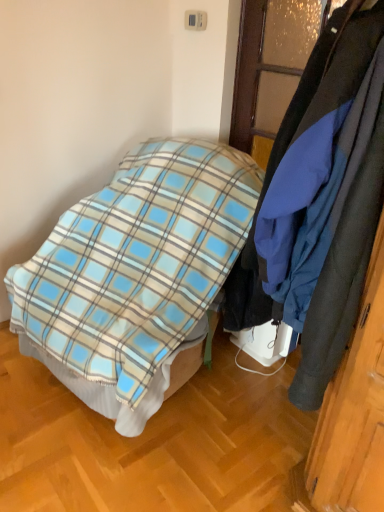
Question: Considering the relative sizes of blue plaid blanket at center and dark blue fabric coat at right in the image provided, is blue plaid blanket at center bigger than dark blue fabric coat at right?

Choices:
 (A) yes
 (B) no

Answer: (A)

Question: Is blue plaid blanket at center thinner than dark blue fabric coat at right?

Choices:
 (A) no
 (B) yes

Answer: (A)

Question: Is blue plaid blanket at center shorter than dark blue fabric coat at right?

Choices:
 (A) no
 (B) yes

Answer: (A)

Question: Is blue plaid blanket at center placed right next to dark blue fabric coat at right?

Choices:
 (A) no
 (B) yes

Answer: (A)

Question: From a real-world perspective, is blue plaid blanket at center located beneath dark blue fabric coat at right?

Choices:
 (A) no
 (B) yes

Answer: (B)

Question: Is blue plaid blanket at center facing away from dark blue fabric coat at right?

Choices:
 (A) no
 (B) yes

Answer: (A)

Question: Considering the relative sizes of dark blue fabric coat at right and blue plaid blanket at center in the image provided, is dark blue fabric coat at right taller than blue plaid blanket at center?

Choices:
 (A) yes
 (B) no

Answer: (B)

Question: Can you confirm if dark blue fabric coat at right is wider than blue plaid blanket at center?

Choices:
 (A) yes
 (B) no

Answer: (B)

Question: Is dark blue fabric coat at right with blue plaid blanket at center?

Choices:
 (A) yes
 (B) no

Answer: (B)

Question: Is dark blue fabric coat at right outside of blue plaid blanket at center?

Choices:
 (A) no
 (B) yes

Answer: (B)

Question: Can you confirm if dark blue fabric coat at right is positioned to the right of blue plaid blanket at center?

Choices:
 (A) yes
 (B) no

Answer: (A)

Question: Is dark blue fabric coat at right to the left of blue plaid blanket at center from the viewer's perspective?

Choices:
 (A) no
 (B) yes

Answer: (A)

Question: In the image, is dark blue fabric coat at right positioned in front of or behind blue plaid blanket at center?

Choices:
 (A) behind
 (B) front

Answer: (B)